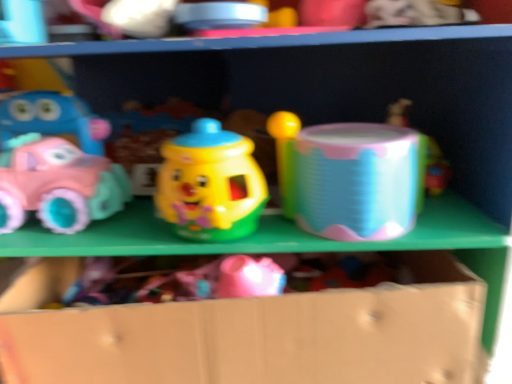
Question: Is holographic plastic drum at center, which appears as the third toy when viewed from the left, positioned with its back to translucent plastic cup at upper right, placed as the 4th toy when sorted from left to right?

Choices:
 (A) no
 (B) yes

Answer: (A)

Question: From the image's perspective, is holographic plastic drum at center, which appears as the third toy when viewed from the left, on top of translucent plastic cup at upper right, placed as the 4th toy when sorted from left to right?

Choices:
 (A) no
 (B) yes

Answer: (A)

Question: From a real-world perspective, is holographic plastic drum at center, which appears as the third toy when viewed from the left, on top of translucent plastic cup at upper right, placed as the 4th toy when sorted from left to right?

Choices:
 (A) yes
 (B) no

Answer: (A)

Question: Does holographic plastic drum at center, marked as the second toy in a right-to-left arrangement, contain translucent plastic cup at upper right, which is counted as the first toy, starting from the right?

Choices:
 (A) yes
 (B) no

Answer: (B)

Question: From a real-world perspective, is holographic plastic drum at center, marked as the second toy in a right-to-left arrangement, beneath translucent plastic cup at upper right, which is counted as the first toy, starting from the right?

Choices:
 (A) yes
 (B) no

Answer: (B)

Question: Does holographic plastic drum at center, which appears as the third toy when viewed from the left, have a lesser width compared to translucent plastic cup at upper right, placed as the 4th toy when sorted from left to right?

Choices:
 (A) no
 (B) yes

Answer: (A)

Question: Is cardboard box at lower center further to camera compared to holographic plastic drum at center, marked as the second toy in a right-to-left arrangement?

Choices:
 (A) no
 (B) yes

Answer: (A)

Question: Can you confirm if cardboard box at lower center is smaller than holographic plastic drum at center, marked as the second toy in a right-to-left arrangement?

Choices:
 (A) yes
 (B) no

Answer: (B)

Question: Is cardboard box at lower center to the right of holographic plastic drum at center, marked as the second toy in a right-to-left arrangement, from the viewer's perspective?

Choices:
 (A) yes
 (B) no

Answer: (B)

Question: Is cardboard box at lower center wider than holographic plastic drum at center, marked as the second toy in a right-to-left arrangement?

Choices:
 (A) no
 (B) yes

Answer: (B)

Question: From the image's perspective, is cardboard box at lower center on holographic plastic drum at center, marked as the second toy in a right-to-left arrangement?

Choices:
 (A) no
 (B) yes

Answer: (A)

Question: Is cardboard box at lower center aimed at holographic plastic drum at center, which appears as the third toy when viewed from the left?

Choices:
 (A) no
 (B) yes

Answer: (A)

Question: Can you confirm if matte pink plastic car at left, which is the fourth toy from right to left, is shorter than holographic plastic drum at center, which appears as the third toy when viewed from the left?

Choices:
 (A) no
 (B) yes

Answer: (A)